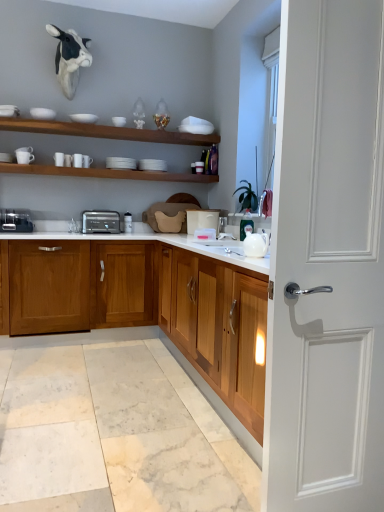
What is the approximate height of white glossy shelves at upper center, the second shelf positioned from the bottom?

white glossy shelves at upper center, the second shelf positioned from the bottom, is 3.06 inches tall.

Image resolution: width=384 pixels, height=512 pixels. Describe the element at coordinates (69, 58) in the screenshot. I see `white matte cow head at upper left` at that location.

Describe the element at coordinates (24, 155) in the screenshot. I see `white glossy mug at left, the fifth tableware positioned from the top` at that location.

The width and height of the screenshot is (384, 512). In order to click on white glossy bowl at upper center, the first tableware when ordered from right to left in this screenshot , I will do `click(119, 121)`.

The image size is (384, 512). What are the coordinates of `white glossy shelves at upper center, the second shelf positioned from the bottom` in the screenshot? It's located at (105, 131).

Which object is more forward, white matte bowl at upper center, the fourth tableware from the bottom, or metallic silver toaster at left, which is the second appliance from right to left?

metallic silver toaster at left, which is the second appliance from right to left, is more forward.

Based on the photo, how different are the orientations of white matte bowl at upper center, acting as the fourth tableware starting from the left, and metallic silver toaster at left, which is the second appliance from right to left, in degrees?

white matte bowl at upper center, acting as the fourth tableware starting from the left, and metallic silver toaster at left, which is the second appliance from right to left, are facing 3.53 degrees away from each other.

The height and width of the screenshot is (512, 384). I want to click on tableware that is the 4th one when counting upward from the metallic silver toaster at left, the first appliance viewed from the left (from the image's perspective), so click(x=84, y=117).

Can you confirm if white matte bowl at upper center, acting as the fourth tableware starting from the left, is positioned to the left of metallic silver toaster at left, which is the second appliance from right to left?

In fact, white matte bowl at upper center, acting as the fourth tableware starting from the left, is to the right of metallic silver toaster at left, which is the second appliance from right to left.

Would you say white plastic container at center, which appears as the second appliance when viewed from the left, is outside white matte door at right?

Yes, white plastic container at center, which appears as the second appliance when viewed from the left, is not within white matte door at right.

From the picture: Who is taller, white plastic container at center, which appears as the second appliance when viewed from the left, or white matte door at right?

white matte door at right is taller.

Does white plastic container at center, which appears as the second appliance when viewed from the left, have a smaller size compared to white matte door at right?

Yes, white plastic container at center, which appears as the second appliance when viewed from the left, is smaller than white matte door at right.

Considering the positions of points (204, 221) and (360, 362), is point (204, 221) farther from camera compared to point (360, 362)?

Yes, it is behind point (360, 362).

Considering the positions of points (3, 225) and (83, 301), is point (3, 225) closer to camera compared to point (83, 301)?

No.

Considering the sizes of objects metallic silver toaster at left, the first appliance viewed from the left, and wooden cabinets at center in the image provided, who is smaller, metallic silver toaster at left, the first appliance viewed from the left, or wooden cabinets at center?

metallic silver toaster at left, the first appliance viewed from the left, is smaller.

Can you confirm if metallic silver toaster at left, the first appliance viewed from the left, is wider than wooden cabinets at center?

In fact, metallic silver toaster at left, the first appliance viewed from the left, might be narrower than wooden cabinets at center.

Can you confirm if metallic silver toaster at left, which is the second appliance from right to left, is shorter than wooden cabinets at center?

Yes, metallic silver toaster at left, which is the second appliance from right to left, is shorter than wooden cabinets at center.

From the image's perspective, which object appears higher, wooden shelf at upper center, which is the 2th shelf from top to bottom, or white glossy bowl at upper center, which is the 3th tableware from bottom to top?

white glossy bowl at upper center, which is the 3th tableware from bottom to top, appears higher in the image.

How many degrees apart are the facing directions of wooden shelf at upper center, which is the 2th shelf from top to bottom, and white glossy bowl at upper center, the 5th tableware when ordered from left to right?

0.723 degrees separate the facing orientations of wooden shelf at upper center, which is the 2th shelf from top to bottom, and white glossy bowl at upper center, the 5th tableware when ordered from left to right.

Considering their positions, is wooden shelf at upper center, which is the 2th shelf from top to bottom, located in front of or behind white glossy bowl at upper center, the 3th tableware from the top?

Clearly, wooden shelf at upper center, which is the 2th shelf from top to bottom, is in front of white glossy bowl at upper center, the 3th tableware from the top.

Is wooden shelf at upper center, arranged as the 1th shelf when ordered from the bottom, situated inside white glossy bowl at upper center, the 3th tableware from the top, or outside?

wooden shelf at upper center, arranged as the 1th shelf when ordered from the bottom, lies outside white glossy bowl at upper center, the 3th tableware from the top.

Does white matte bowl at upper center, the fourth tableware from the bottom, have a greater height compared to white glossy teapot at right?

Incorrect, the height of white matte bowl at upper center, the fourth tableware from the bottom, is not larger of that of white glossy teapot at right.

From the image's perspective, is white matte bowl at upper center, the fourth tableware from the bottom, located above or below white glossy teapot at right?

Based on their image positions, white matte bowl at upper center, the fourth tableware from the bottom, is located above white glossy teapot at right.

Does white matte cow head at upper left have a larger size compared to white matte door at right?

Indeed, white matte cow head at upper left has a larger size compared to white matte door at right.

Image resolution: width=384 pixels, height=512 pixels. In order to click on animal above the white matte door at right (from the image's perspective) in this screenshot , I will do `click(69, 58)`.

Between white matte cow head at upper left and white matte door at right, which one has smaller width?

With smaller width is white matte door at right.

How much distance is there between white matte cow head at upper left and white matte door at right?

white matte cow head at upper left and white matte door at right are 3.04 meters apart.

How different are the orientations of wooden shelf at upper center, arranged as the 1th shelf when ordered from the bottom, and white plastic container at center, which appears as the second appliance when viewed from the left, in degrees?

87.2 degrees.

Is wooden shelf at upper center, arranged as the 1th shelf when ordered from the bottom, far away from white plastic container at center, which appears as the second appliance when viewed from the left?

No, there isn't a large distance between wooden shelf at upper center, arranged as the 1th shelf when ordered from the bottom, and white plastic container at center, which appears as the second appliance when viewed from the left.

From the image's perspective, which is below, wooden shelf at upper center, which is the 2th shelf from top to bottom, or white plastic container at center, which appears as the second appliance when viewed from the left?

From the image's view, white plastic container at center, which appears as the second appliance when viewed from the left, is below.

How distant is wooden shelf at upper center, arranged as the 1th shelf when ordered from the bottom, from white plastic container at center, which appears as the second appliance when viewed from the left?

27.52 inches.

From the metallic silver toaster at left, the first appliance viewed from the left, count 4th tableware to the right and point to it. Please provide its 2D coordinates.

[(84, 117)]

You are a GUI agent. You are given a task and a screenshot of the screen. Output one action in this format:
    pyautogui.click(x=<x>, y=<y>)
    Task: Click on the 2nd appliance located above the white matte door at right (from a real-world perspective)
    This screenshot has width=384, height=512.
    Given the screenshot: What is the action you would take?
    pyautogui.click(x=202, y=220)

Considering their positions, is white plastic container at center, which appears as the second appliance when viewed from the left, positioned further to white glossy shelves at upper center, the 1th shelf in the top-to-bottom sequence, than white matte door at right?

white matte door at right.

Based on their spatial positions, is white glossy bowl at upper center, the 5th tableware when ordered from left to right, or white glossy shelves at upper center, the 1th shelf in the top-to-bottom sequence, closer to white matte bowl at upper center, the fourth tableware from the bottom?

white glossy bowl at upper center, the 5th tableware when ordered from left to right, is positioned closer to the anchor white matte bowl at upper center, the fourth tableware from the bottom.

Estimate the real-world distances between objects in this image. Which object is further from black plastic toaster at center, metallic silver toaster at left, the first appliance viewed from the left, or white plastic container at center, which appears as the second appliance when viewed from the left?

Among the two, white plastic container at center, which appears as the second appliance when viewed from the left, is located further to black plastic toaster at center.

Based on their spatial positions, is white glossy mug at left, arranged as the fifth tableware when viewed from the right, or white glossy teapot at right closer to white matte bowl at upper center, the 2th tableware viewed from the top?

white glossy mug at left, arranged as the fifth tableware when viewed from the right, is closer to white matte bowl at upper center, the 2th tableware viewed from the top.

Consider the image. Estimate the real-world distances between objects in this image. Which object is closer to white glossy teapot at right, white glossy mug at left, arranged as the fifth tableware when viewed from the right, or wooden shelf at upper center, arranged as the 1th shelf when ordered from the bottom?

Among the two, wooden shelf at upper center, arranged as the 1th shelf when ordered from the bottom, is located nearer to white glossy teapot at right.

Estimate the real-world distances between objects in this image. Which object is closer to white matte door at right, white plastic container at center, which appears as the second appliance when viewed from the left, or white glossy teapot at right?

Based on the image, white glossy teapot at right appears to be nearer to white matte door at right.

Looking at the image, which one is located further to wooden shelf at upper center, arranged as the 1th shelf when ordered from the bottom, wooden cabinets at center or white glossy teapot at right?

white glossy teapot at right is further to wooden shelf at upper center, arranged as the 1th shelf when ordered from the bottom.

Based on their spatial positions, is white glossy shelves at upper center, the 1th shelf in the top-to-bottom sequence, or black plastic toaster at center closer to white matte cow head at upper left?

white glossy shelves at upper center, the 1th shelf in the top-to-bottom sequence, is positioned closer to the anchor white matte cow head at upper left.

Identify the location of tea pot between white matte door at right and wooden cabinets at center along the z-axis. 255,244.

The image size is (384, 512). Identify the location of animal situated between white glossy mug at left, acting as the first tableware starting from the left, and white plastic container at center, the 1th appliance when ordered from right to left, from left to right. (69, 58).

Where is `toaster between wooden shelf at upper center, arranged as the 1th shelf when ordered from the bottom, and wooden cabinets at center in the up-down direction`? toaster between wooden shelf at upper center, arranged as the 1th shelf when ordered from the bottom, and wooden cabinets at center in the up-down direction is located at coordinates (100, 222).

Where is `shelf situated between wooden shelf at upper center, arranged as the 1th shelf when ordered from the bottom, and white plastic container at center, which appears as the second appliance when viewed from the left, from left to right`? shelf situated between wooden shelf at upper center, arranged as the 1th shelf when ordered from the bottom, and white plastic container at center, which appears as the second appliance when viewed from the left, from left to right is located at coordinates (105, 131).